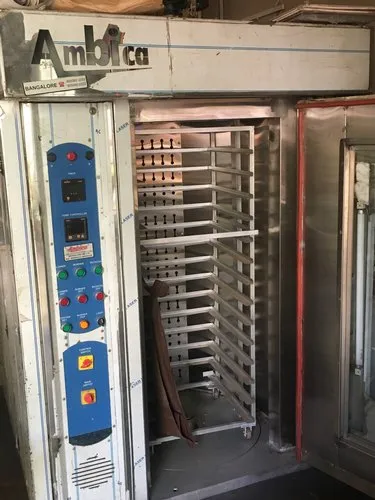
Identify the location of window in door. (370, 405).